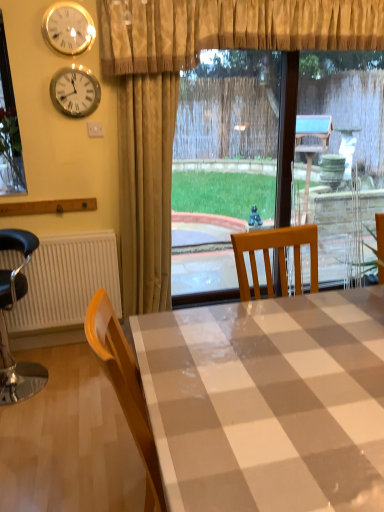
The width and height of the screenshot is (384, 512). What are the coordinates of `free location above white glossy table at center (from a real-world perspective)` in the screenshot? It's located at (288, 365).